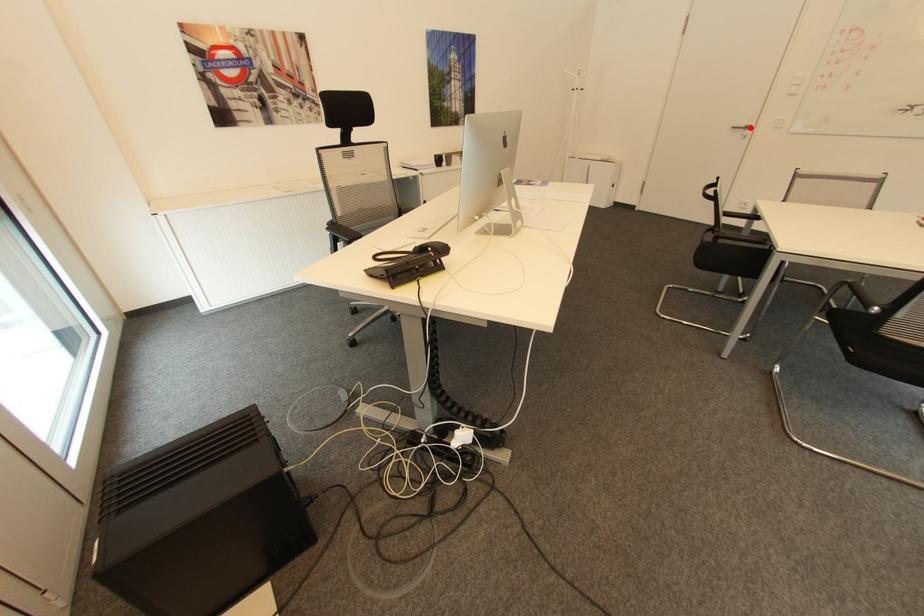
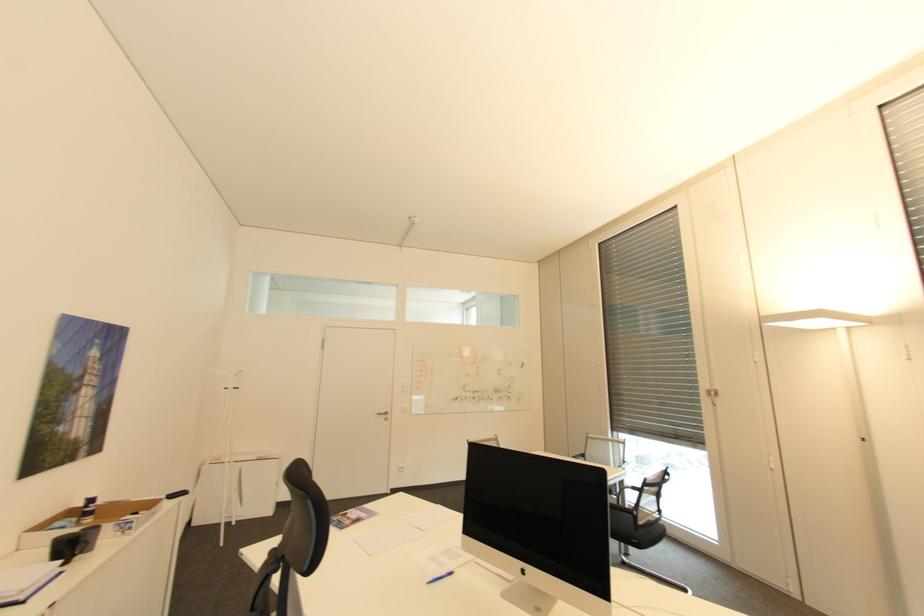
Question: A red point is marked in image1. In image2, is the corresponding 3D point closer to the camera or farther? Reply with the corresponding letter.

Choices:
 (A) The corresponding 3D point is closer.
 (B) The corresponding 3D point is farther.

Answer: (B)